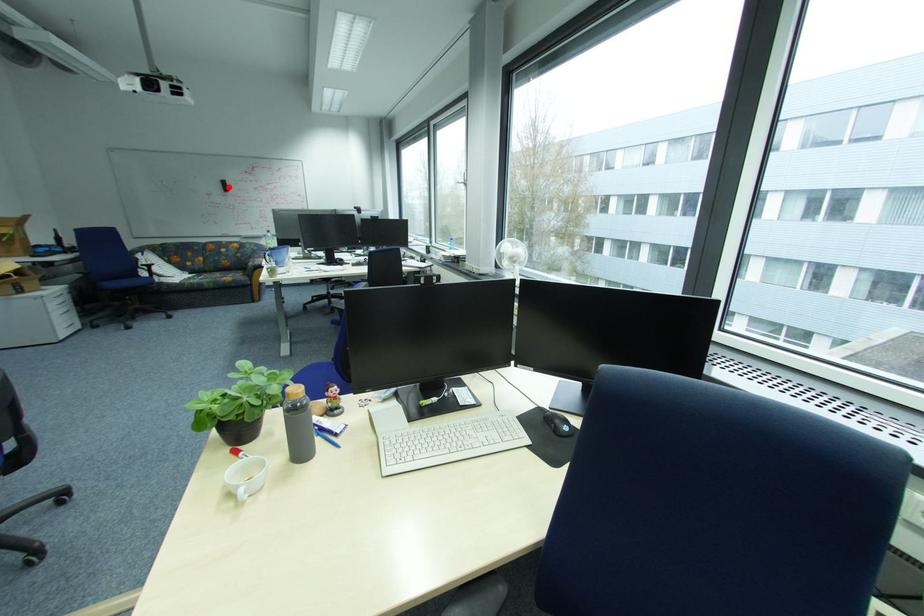
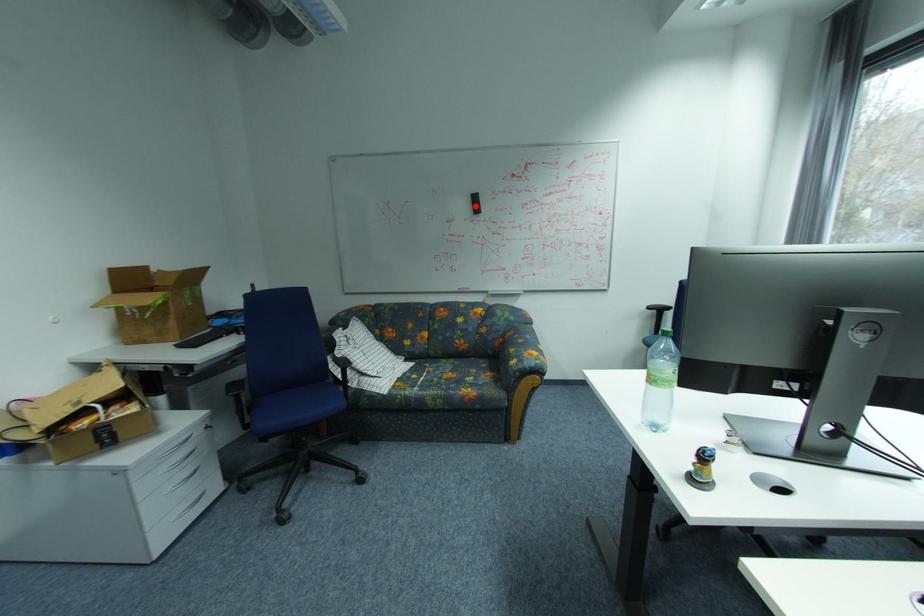
I am providing you with two images of the same scene from different viewpoints. A red point is marked on the first image and another point is marked on the second image. Are the points marked in image1 and image2 representing the same 3D position?

Yes